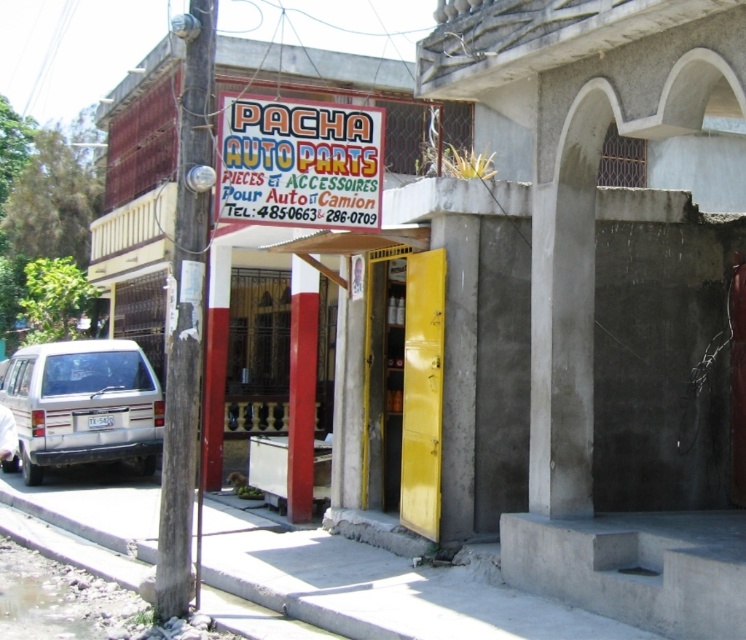
Question: Is bright yellow signboard at upper center above white matte suv at lower left?

Choices:
 (A) no
 (B) yes

Answer: (B)

Question: Can you confirm if bright yellow signboard at upper center is positioned above white matte suv at lower left?

Choices:
 (A) no
 (B) yes

Answer: (B)

Question: Which point is closer to the camera?

Choices:
 (A) (260, 195)
 (B) (40, 472)

Answer: (A)

Question: Among these objects, which one is nearest to the camera?

Choices:
 (A) white matte suv at lower left
 (B) bright yellow signboard at upper center

Answer: (B)

Question: Which of the following is the closest to the observer?

Choices:
 (A) (81, 385)
 (B) (330, 125)

Answer: (B)

Question: Can you confirm if bright yellow signboard at upper center is wider than white matte suv at lower left?

Choices:
 (A) yes
 (B) no

Answer: (B)